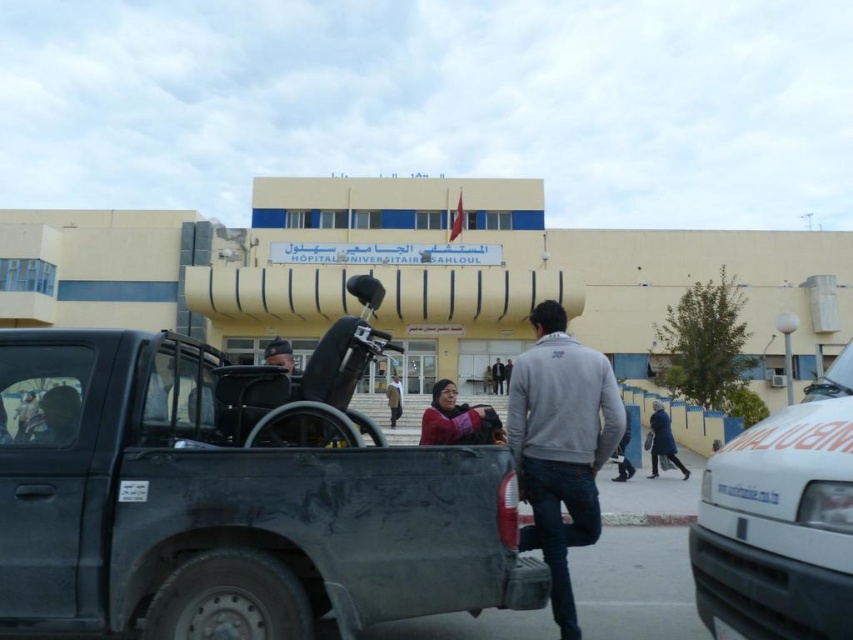
Question: Which of the following is the farthest from the observer?

Choices:
 (A) white matte van at right
 (B) gray matte jacket at center
 (C) matte black truck at center

Answer: (B)

Question: Can you confirm if white matte van at right is positioned to the left of gray matte jacket at center?

Choices:
 (A) yes
 (B) no

Answer: (A)

Question: Which point is closer to the camera taking this photo?

Choices:
 (A) (492, 556)
 (B) (561, 424)
 (C) (772, 486)

Answer: (C)

Question: Which point is farther from the camera taking this photo?

Choices:
 (A) (136, 570)
 (B) (547, 504)
 (C) (817, 467)

Answer: (B)

Question: Is white matte van at right bigger than gray matte jacket at center?

Choices:
 (A) no
 (B) yes

Answer: (A)

Question: Is white matte van at right thinner than gray matte jacket at center?

Choices:
 (A) no
 (B) yes

Answer: (B)